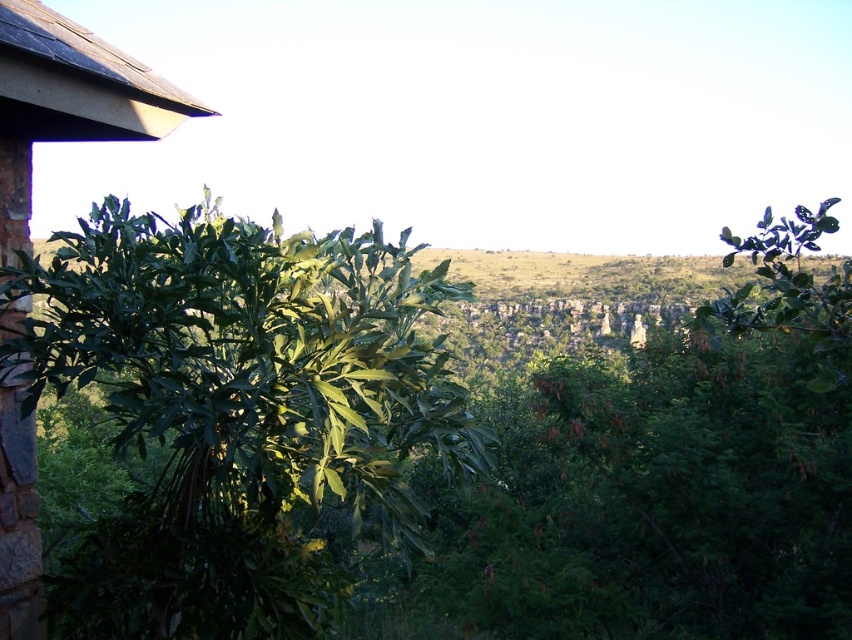
You are a hiker trying to navigate through this landscape. You notice the green leafy plant at center and the brown stone hut at left. Which object would you estimate is physically bigger in size?

The green leafy plant at center is larger in size compared to the brown stone hut at left according to the description.

You are standing in the serene outdoor landscape and want to place a small garden gnome exactly halfway between point (381, 417) and point (193, 100). Will the gnome be closer to the stone structure on the left or the rolling hills in the midground?

The gnome will be closer to the stone structure on the left because point (381, 417) is further to the viewer than point (193, 100), so the halfway point is closer to the stone structure.

Based on the scene description, where is the green leafy plant at center located in terms of coordinates?

The green leafy plant at center is located at point coordinates of (237, 412).